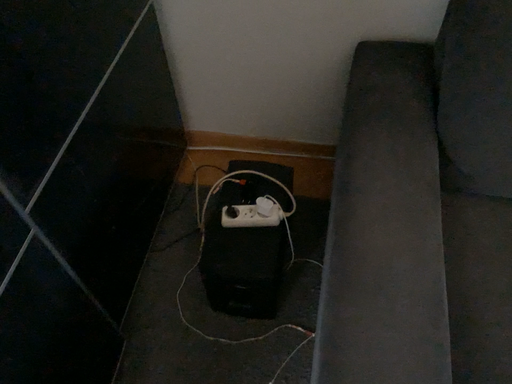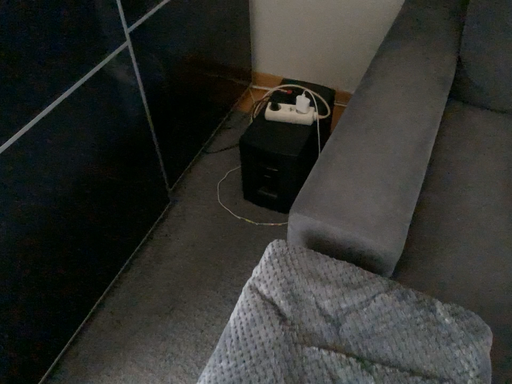
Question: How did the camera likely rotate when shooting the video?

Choices:
 (A) rotated right
 (B) rotated left

Answer: (B)